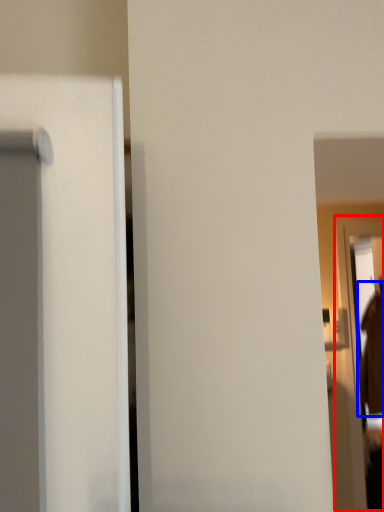
Question: Which object is further to the camera taking this photo, screen door (highlighted by a red box) or robe (highlighted by a blue box)?

Choices:
 (A) screen door
 (B) robe

Answer: (B)